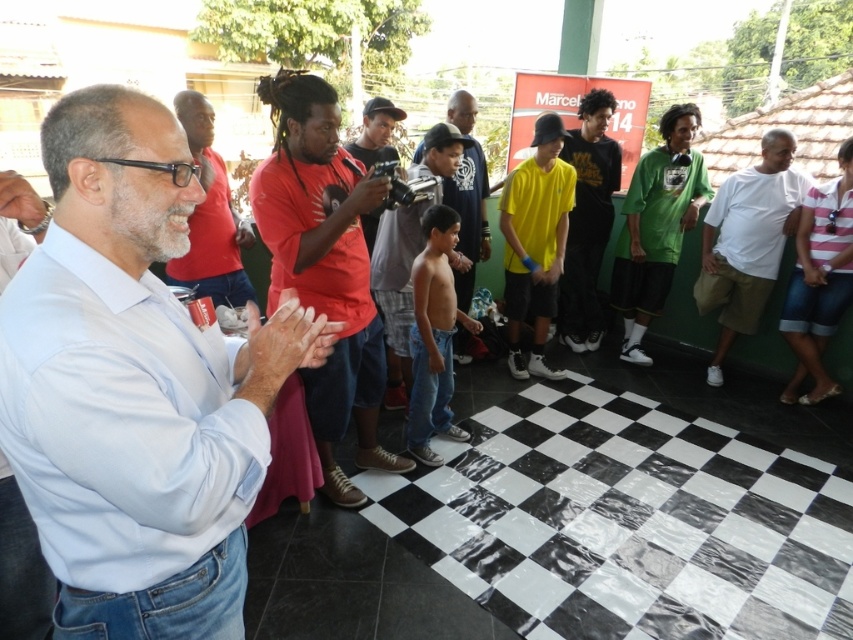
Between light blue shirt at center and white cotton shirt at right, which one appears on the right side from the viewer's perspective?

white cotton shirt at right

Who is higher up, light blue shirt at center or white cotton shirt at right?

white cotton shirt at right

Locate an element on the screen. light blue shirt at center is located at coordinates (135, 387).

Does matte red shirt at center have a greater height compared to matte black shirt at center?

Indeed, matte red shirt at center has a greater height compared to matte black shirt at center.

Does matte red shirt at center come behind matte black shirt at center?

No, matte red shirt at center is closer to the viewer.

Is point (300, 292) positioned before point (222, 275)?

Yes, point (300, 292) is closer to viewer.

At what (x,y) coordinates should I click in order to perform the action: click on matte red shirt at center. Please return your answer as a coordinate pair (x, y). Image resolution: width=853 pixels, height=640 pixels. Looking at the image, I should click on (323, 266).

Measure the distance from light blue shirt at center to matte black shirt at center.

light blue shirt at center and matte black shirt at center are 5.68 feet apart.

Locate an element on the screen. light blue shirt at center is located at coordinates (135, 387).